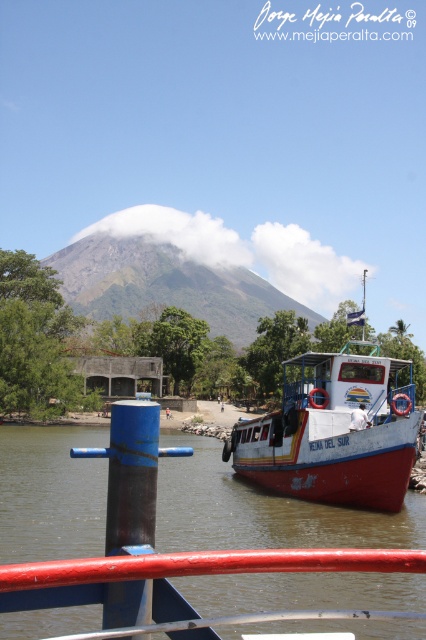
Question: Based on their relative distances, which object is nearer to the white matte boat at center?

Choices:
 (A) blue metallic pole at center
 (B) brown water at lower left
 (C) red painted metal railing at lower center

Answer: (B)

Question: Does brown water at lower left appear on the left side of white matte boat at center?

Choices:
 (A) yes
 (B) no

Answer: (A)

Question: Which point is closer to the camera?

Choices:
 (A) (147, 476)
 (B) (316, 460)
 (C) (131, 609)

Answer: (C)

Question: Where is white matte boat at center located in relation to blue metallic pole at center in the image?

Choices:
 (A) above
 (B) below

Answer: (B)

Question: Is brown water at lower left to the right of blue metallic pole at center from the viewer's perspective?

Choices:
 (A) yes
 (B) no

Answer: (B)

Question: Which object is positioned closest to the red painted metal railing at lower center?

Choices:
 (A) white matte boat at center
 (B) brown water at lower left

Answer: (A)